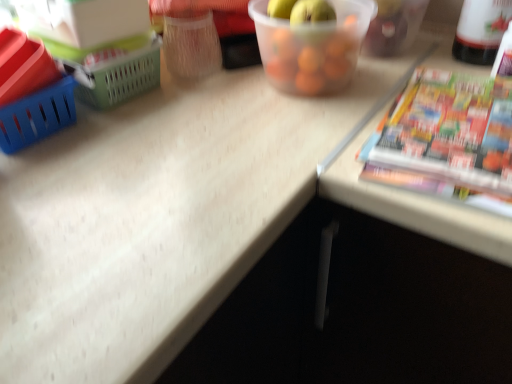
Question: Does translucent plastic container at upper center have a greater height compared to white plastic bottle at upper right?

Choices:
 (A) yes
 (B) no

Answer: (B)

Question: Is translucent plastic container at upper center completely or partially outside of white plastic bottle at upper right?

Choices:
 (A) yes
 (B) no

Answer: (A)

Question: From the image's perspective, is translucent plastic container at upper center beneath white plastic bottle at upper right?

Choices:
 (A) no
 (B) yes

Answer: (B)

Question: From a real-world perspective, is translucent plastic container at upper center located beneath white plastic bottle at upper right?

Choices:
 (A) no
 (B) yes

Answer: (B)

Question: Is translucent plastic container at upper center to the right of white plastic bottle at upper right from the viewer's perspective?

Choices:
 (A) yes
 (B) no

Answer: (B)

Question: Is white plastic bottle at upper right bigger or smaller than translucent plastic container at upper center?

Choices:
 (A) small
 (B) big

Answer: (A)

Question: From the image's perspective, is white plastic bottle at upper right positioned above or below translucent plastic container at upper center?

Choices:
 (A) above
 (B) below

Answer: (A)

Question: Do you think white plastic bottle at upper right is within translucent plastic container at upper center, or outside of it?

Choices:
 (A) inside
 (B) outside

Answer: (B)

Question: Is white plastic bottle at upper right wider or thinner than translucent plastic container at upper center?

Choices:
 (A) wide
 (B) thin

Answer: (B)

Question: Is translucent plastic container at upper center wider or thinner than white plastic bottle at upper right?

Choices:
 (A) thin
 (B) wide

Answer: (B)

Question: Is translucent plastic container at upper center taller or shorter than white plastic bottle at upper right?

Choices:
 (A) short
 (B) tall

Answer: (A)

Question: Considering the positions of translucent plastic container at upper center and white plastic bottle at upper right in the image, is translucent plastic container at upper center bigger or smaller than white plastic bottle at upper right?

Choices:
 (A) small
 (B) big

Answer: (B)

Question: Considering their positions, is translucent plastic container at upper center located in front of or behind white plastic bottle at upper right?

Choices:
 (A) front
 (B) behind

Answer: (A)

Question: Would you say white plastic bottle at upper right is to the left or to the right of multicolored glossy paperback book at right in the picture?

Choices:
 (A) left
 (B) right

Answer: (B)

Question: Considering the positions of white plastic bottle at upper right and multicolored glossy paperback book at right in the image, is white plastic bottle at upper right bigger or smaller than multicolored glossy paperback book at right?

Choices:
 (A) small
 (B) big

Answer: (B)